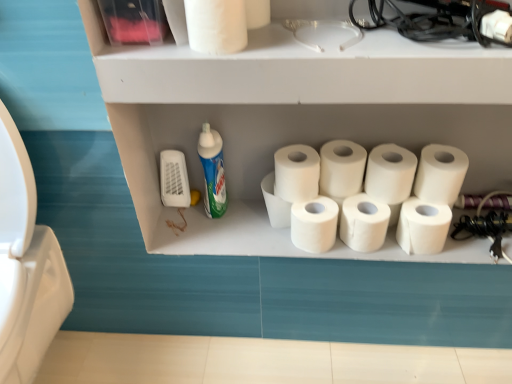
Image resolution: width=512 pixels, height=384 pixels. I want to click on vacant space situated on the left part of white matte toilet paper at center, placed as the 9th toilet paper when sorted from right to left, so click(213, 221).